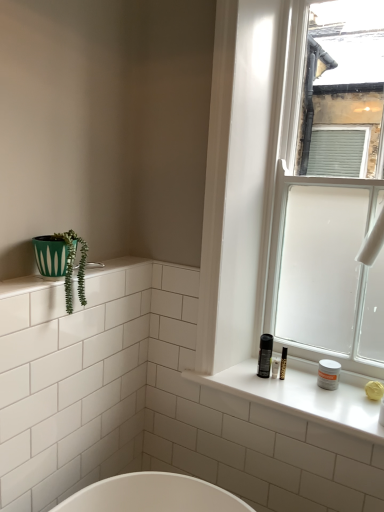
Where is `free point above white glossy window sill at right (from a real-world perspective)`? The image size is (384, 512). free point above white glossy window sill at right (from a real-world perspective) is located at coordinates (314, 378).